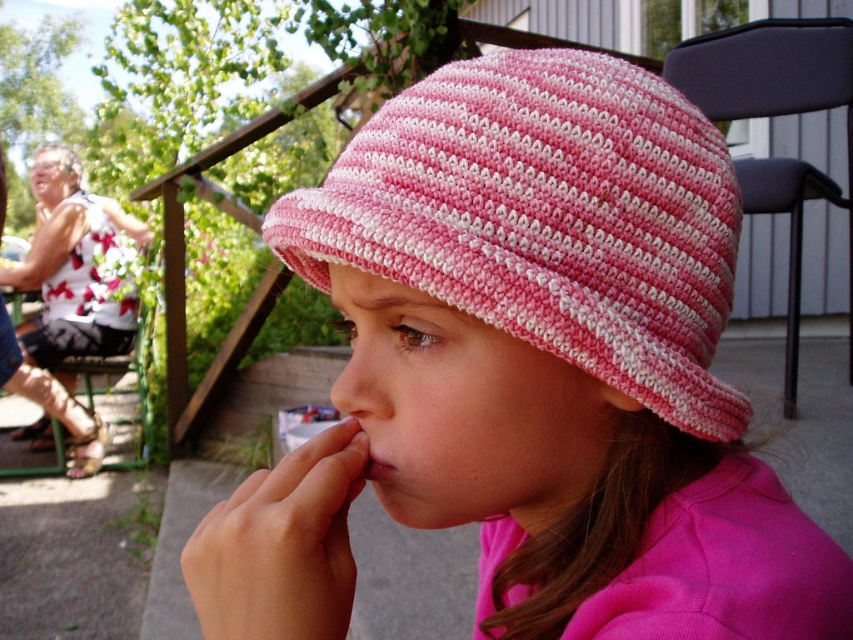
Between pink striped knit hat at center and pink knitted nose at center, which one has more height?

pink striped knit hat at center

Who is higher up, pink striped knit hat at center or pink knitted nose at center?

Positioned higher is pink striped knit hat at center.

Is point (398, 125) closer to camera compared to point (349, 381)?

No.

The image size is (853, 640). What are the coordinates of `pink striped knit hat at center` in the screenshot? It's located at (546, 220).

Can you confirm if pink knitted hat at center is shorter than pink knitted nose at center?

In fact, pink knitted hat at center may be taller than pink knitted nose at center.

Who is taller, pink knitted hat at center or pink knitted nose at center?

With more height is pink knitted hat at center.

Is point (426, 145) behind point (384, 417)?

No, (426, 145) is closer to viewer.

Locate an element on the screen. This screenshot has width=853, height=640. pink knitted hat at center is located at coordinates (531, 372).

Between pink knitted hat at center and pink striped knit hat at center, which one appears on the right side from the viewer's perspective?

pink striped knit hat at center

Which is behind, point (387, 145) or point (699, 420)?

The point (699, 420) is more distant.

Is point (637, 349) positioned behind point (709, 404)?

No, (637, 349) is closer to viewer.

The width and height of the screenshot is (853, 640). I want to click on pink knitted hat at center, so click(531, 372).